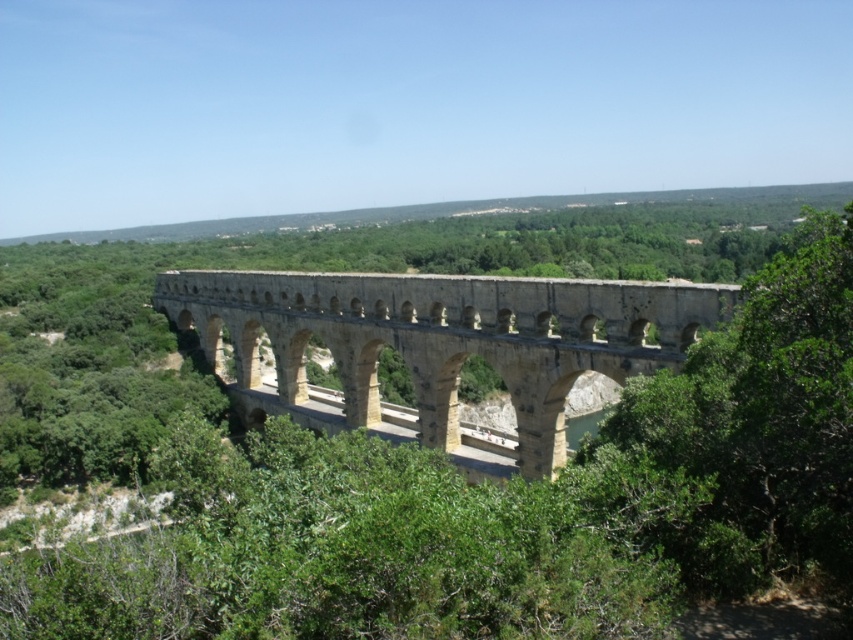
Who is lower down, green leafy tree at center or stone arch bridge at center?

green leafy tree at center is lower down.

Is green leafy tree at center below stone arch bridge at center?

Yes, green leafy tree at center is below stone arch bridge at center.

Which is behind, point (695, 520) or point (436, 360)?

The point (436, 360) is behind.

You are a GUI agent. You are given a task and a screenshot of the screen. Output one action in this format:
    pyautogui.click(x=<x>, y=<y>)
    Task: Click on the green leafy tree at center
    
    Given the screenshot: What is the action you would take?
    pyautogui.click(x=503, y=506)